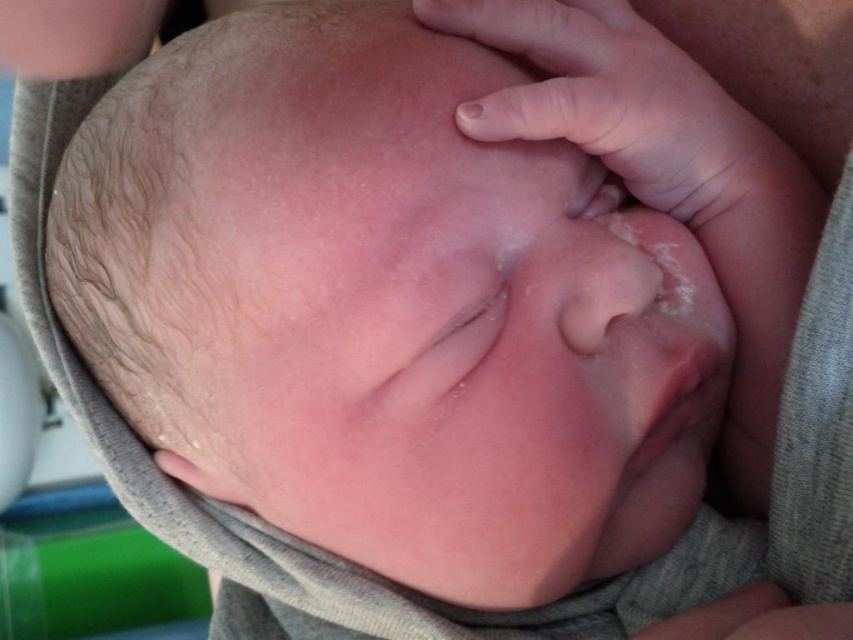
Who is positioned more to the left, smooth skin hand at upper center or smooth skin hand at upper left?

smooth skin hand at upper left

Is point (547, 1) closer to viewer compared to point (35, 76)?

Yes, it is.

What are the coordinates of `smooth skin hand at upper center` in the screenshot? It's located at (616, 102).